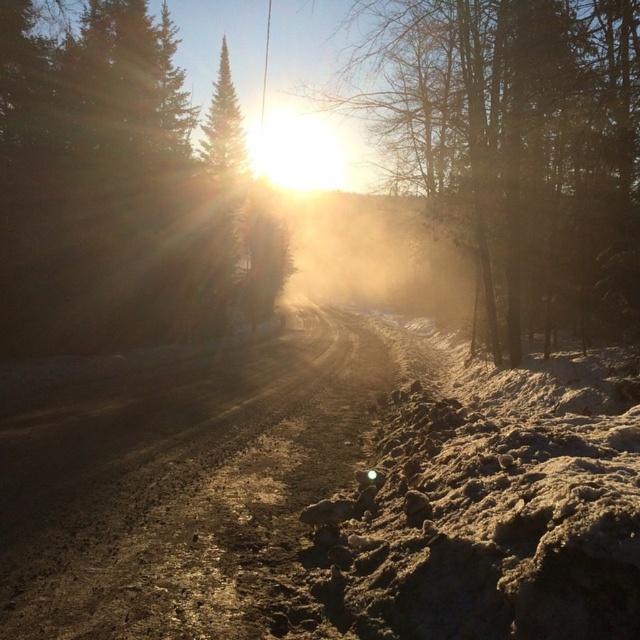
You are standing at the point marked as point (x=221, y=422) in the winter scene. The road ahead is muddy and slippery. If you walk straight ahead, will you be able to see the sun? Explain your reasoning based on the scene description.

Based on the scene description, the sun is positioned low on the horizon and partially obscured by trees. Since you are standing at point (x=221, y=422), which is 10.40 meters away from the viewer, your line of sight might still be blocked by the trees mentioned in the scene. Therefore, it is possible that the sun would not be fully visible if the trees obstruct the view along the road.

In the scene shown: You are standing at the edge of the dull brown dirt track at center and want to take a photo of the green matte tree at upper left. Which object is closer to the camera in this scene?

The green matte tree at upper left is closer to the camera than the dull brown dirt track at center because it is taller, blocking the sun and casting a shadow over the track.